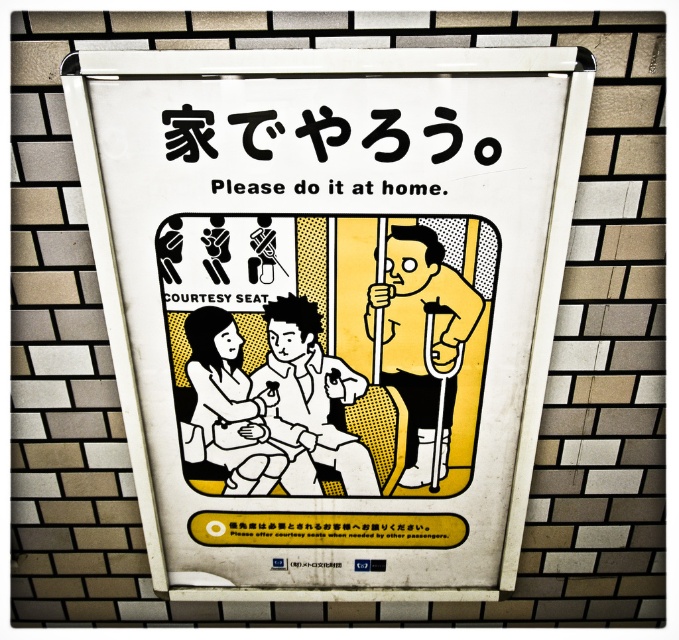
You are looking at the public notice poster and see two points marked on it. Which point is closer to you, point (382, 346) or point (227, 324)?

Point (382, 346) is further to the viewer than point (227, 324), so point (227, 324) is closer to you.

Based on the scene described, where are the yellow matte crutches at center located in relation to the other elements in the image?

The yellow matte crutches at center are positioned at the coordinates point [422,339] in the image.